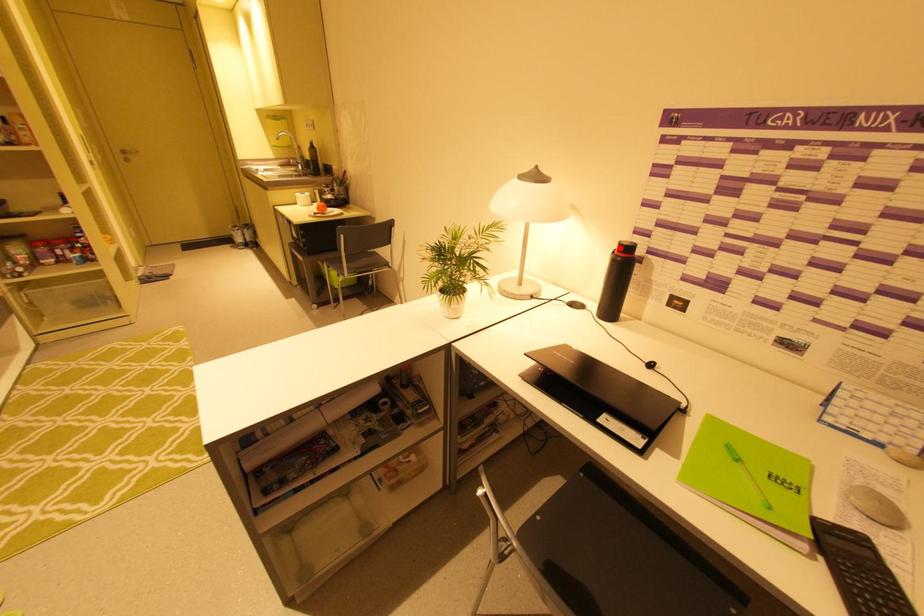
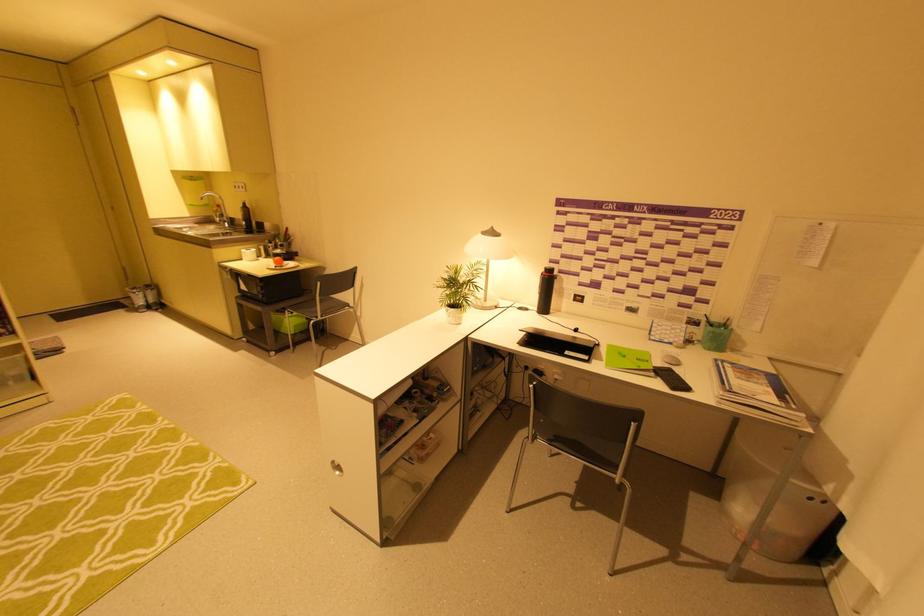
Locate, in the second image, the point that corresponds to the highlighted location in the first image.

(546, 270)